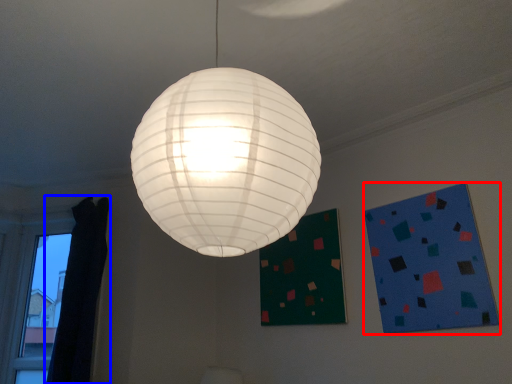
Question: Which point is closer to the camera, design (highlighted by a red box) or curtain (highlighted by a blue box)?

Choices:
 (A) design
 (B) curtain

Answer: (A)